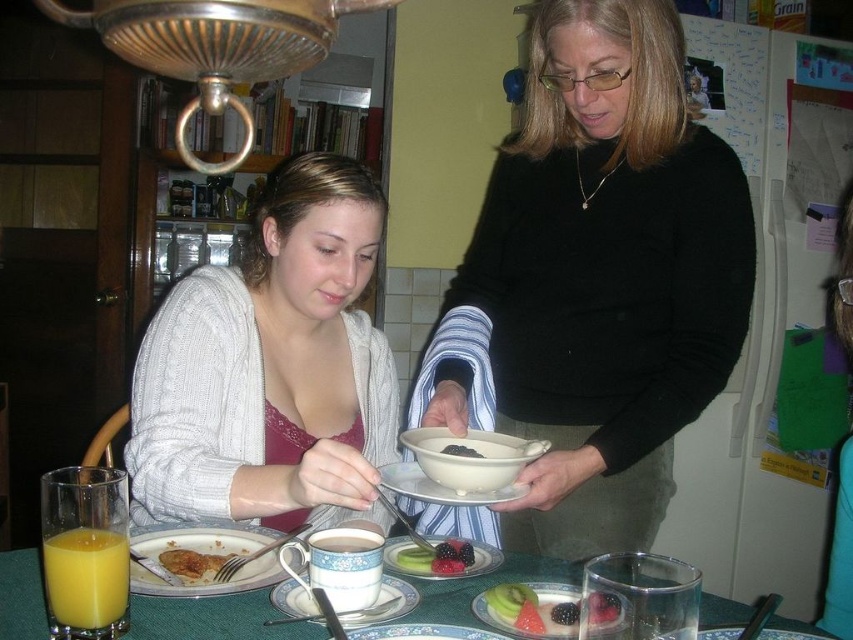
Question: Which point is closer to the camera taking this photo?

Choices:
 (A) (334, 360)
 (B) (393, 472)

Answer: (B)

Question: Which object is the farthest from the matte ceramic plate at center?

Choices:
 (A) golden fried chicken at plate center
 (B) white ceramic plate at center
 (C) porcelain plate with fruit at center
 (D) black matte bowl at center

Answer: (A)

Question: Does cable-knit sweater at center appear under translucent glass platter at center?

Choices:
 (A) yes
 (B) no

Answer: (B)

Question: Does cable-knit sweater at center appear on the right side of porcelain plate at center?

Choices:
 (A) yes
 (B) no

Answer: (B)

Question: Which of the following is the closest to the observer?

Choices:
 (A) (410, 602)
 (B) (163, 584)
 (C) (468, 584)

Answer: (B)

Question: Is translucent glass juice at lower left closer to the viewer compared to matte ceramic mug at center?

Choices:
 (A) no
 (B) yes

Answer: (B)